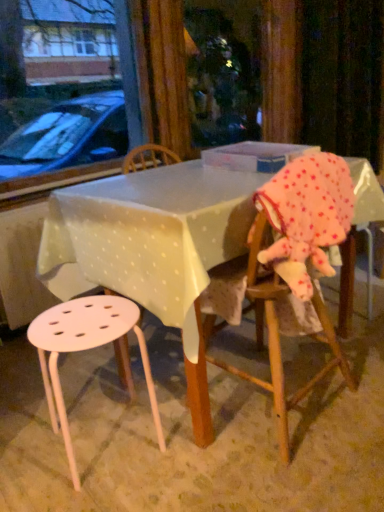
Find the location of a particular element. The width and height of the screenshot is (384, 512). vacant space that is to the left of white plastic stool at lower left is located at coordinates (28, 440).